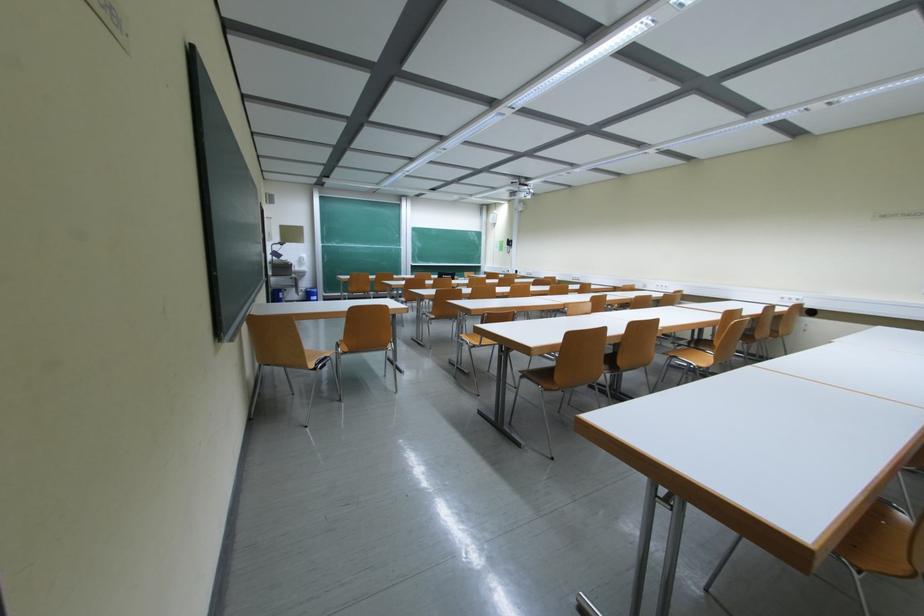
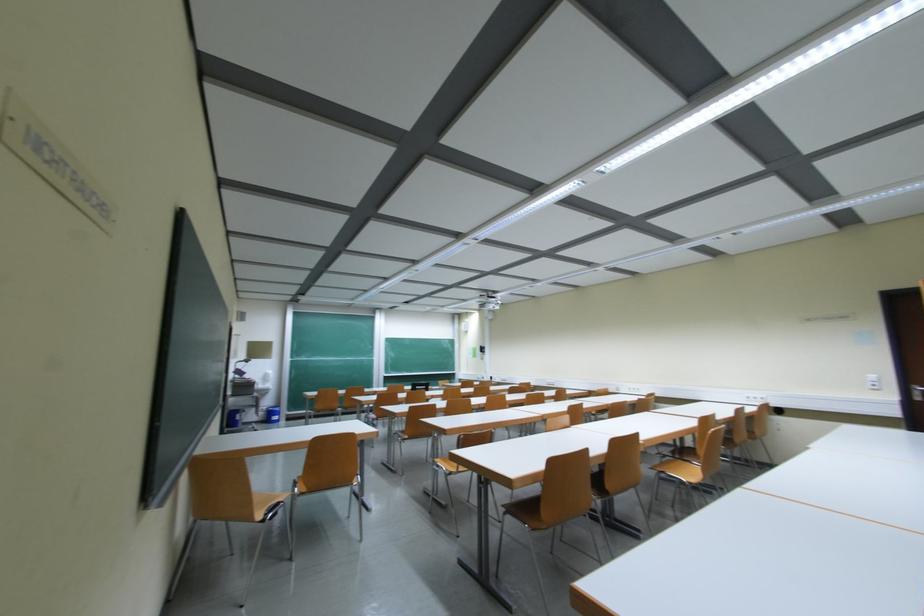
Which direction would the cameraman need to move to produce the second image?

The movement direction of the cameraman is right, backward.